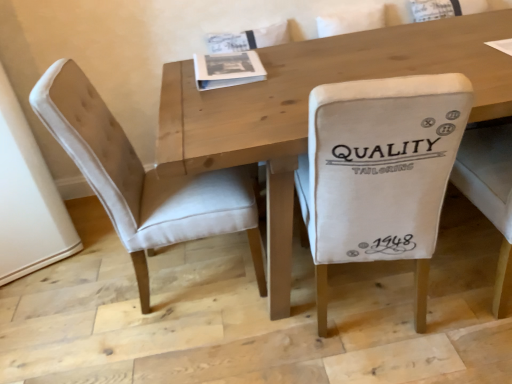
The height and width of the screenshot is (384, 512). Describe the element at coordinates (227, 70) in the screenshot. I see `white paper book at center` at that location.

Find the location of a particular element. The image size is (512, 384). white paper book at center is located at coordinates (227, 70).

From the image's perspective, is beige fabric chair at left, the 2th chair in the right-to-left sequence, over white paper book at center?

No, from the image's perspective, beige fabric chair at left, the 2th chair in the right-to-left sequence, is not above white paper book at center.

In the scene shown: Can you confirm if beige fabric chair at left, the 1th chair in the left-to-right sequence, is smaller than white paper book at center?

No, beige fabric chair at left, the 1th chair in the left-to-right sequence, is not smaller than white paper book at center.

Considering the sizes of objects beige fabric chair at left, the 2th chair in the right-to-left sequence, and white paper book at center in the image provided, who is thinner, beige fabric chair at left, the 2th chair in the right-to-left sequence, or white paper book at center?

white paper book at center is thinner.

Considering the positions of objects beige fabric chair at left, the 1th chair in the left-to-right sequence, and white paper book at center in the image provided, who is more to the left, beige fabric chair at left, the 1th chair in the left-to-right sequence, or white paper book at center?

Positioned to the left is beige fabric chair at left, the 1th chair in the left-to-right sequence.

Which is less distant, (280,201) or (259,71)?

Point (280,201) is closer to the camera than point (259,71).

Does wooden table at center touch white paper book at center?

No, wooden table at center is not beside white paper book at center.

From the image's perspective, is wooden table at center located above or below white paper book at center?

Based on their image positions, wooden table at center is located beneath white paper book at center.

Considering the sizes of wooden table at center and white paper book at center in the image, is wooden table at center taller or shorter than white paper book at center?

In the image, wooden table at center appears to be taller than white paper book at center.

Which object is further away from the camera taking this photo, beige fabric chair at left, the 1th chair in the left-to-right sequence, or white fabric chair at center, the 2th chair when ordered from left to right?

beige fabric chair at left, the 1th chair in the left-to-right sequence, is more distant.

Can you tell me how much beige fabric chair at left, the 2th chair in the right-to-left sequence, and white fabric chair at center, the first chair from the right, differ in facing direction?

The angular difference between beige fabric chair at left, the 2th chair in the right-to-left sequence, and white fabric chair at center, the first chair from the right, is 80.8 degrees.

Identify the location of chair in front of the beige fabric chair at left, the 1th chair in the left-to-right sequence. Image resolution: width=512 pixels, height=384 pixels. click(380, 172).

Based on their sizes in the image, would you say white paper book at center is bigger or smaller than wooden table at center?

Considering their sizes, white paper book at center takes up less space than wooden table at center.

Which is more to the left, white paper book at center or wooden table at center?

white paper book at center is more to the left.

Which is in front, point (246, 60) or point (269, 80)?

The point (269, 80) is closer.

There is a wooden table at center. What are the coordinates of `magazine above it (from a real-world perspective)` in the screenshot? It's located at (227, 70).

From a real-world perspective, is white paper book at center on beige fabric chair at left, the 1th chair in the left-to-right sequence?

Yes, from a real-world perspective, white paper book at center is above beige fabric chair at left, the 1th chair in the left-to-right sequence.

From their relative heights in the image, would you say white paper book at center is taller or shorter than beige fabric chair at left, the 2th chair in the right-to-left sequence?

In the image, white paper book at center appears to be shorter than beige fabric chair at left, the 2th chair in the right-to-left sequence.

Could you tell me if white paper book at center is facing beige fabric chair at left, the 1th chair in the left-to-right sequence?

Yes, white paper book at center is aimed at beige fabric chair at left, the 1th chair in the left-to-right sequence.

Does white paper book at center have a greater width compared to beige fabric chair at left, the 2th chair in the right-to-left sequence?

No.

Does white fabric chair at center, the first chair from the right, have a larger size compared to wooden table at center?

No, white fabric chair at center, the first chair from the right, is not bigger than wooden table at center.

Does white fabric chair at center, the 2th chair when ordered from left to right, lie behind wooden table at center?

No, white fabric chair at center, the 2th chair when ordered from left to right, is in front of wooden table at center.

Does point (413, 240) appear closer or farther from the camera than point (353, 68)?

Clearly, point (413, 240) is closer to the camera than point (353, 68).

Is white fabric chair at center, the 2th chair when ordered from left to right, not near wooden table at center?

No, white fabric chair at center, the 2th chair when ordered from left to right, is not far from wooden table at center.

Find the location of a particular element. magazine above the white fabric chair at center, the 2th chair when ordered from left to right (from a real-world perspective) is located at coordinates (227, 70).

Based on the photo, looking at the image, does white fabric chair at center, the 2th chair when ordered from left to right, seem bigger or smaller compared to white paper book at center?

Considering their sizes, white fabric chair at center, the 2th chair when ordered from left to right, takes up more space than white paper book at center.

Is white fabric chair at center, the 2th chair when ordered from left to right, next to white paper book at center?

No, white fabric chair at center, the 2th chair when ordered from left to right, is not making contact with white paper book at center.

Does white fabric chair at center, the 2th chair when ordered from left to right, turn towards white paper book at center?

No, white fabric chair at center, the 2th chair when ordered from left to right, is not aimed at white paper book at center.

Locate an element on the screen. The image size is (512, 384). chair on the left of white paper book at center is located at coordinates pyautogui.click(x=143, y=178).

The height and width of the screenshot is (384, 512). I want to click on table that appears below the white paper book at center (from a real-world perspective), so click(x=307, y=107).

When comparing their distances from wooden table at center, does white fabric chair at center, the 2th chair when ordered from left to right, or white paper book at center seem further?

white fabric chair at center, the 2th chair when ordered from left to right, is positioned further to the anchor wooden table at center.

From the image, which object appears to be farther from white paper book at center, wooden table at center or white fabric chair at center, the first chair from the right?

The object further to white paper book at center is white fabric chair at center, the first chair from the right.

When comparing their distances from white paper book at center, does beige fabric chair at left, the 1th chair in the left-to-right sequence, or wooden table at center seem further?

Among the two, beige fabric chair at left, the 1th chair in the left-to-right sequence, is located further to white paper book at center.

From the image, which object appears to be farther from white fabric chair at center, the 2th chair when ordered from left to right, wooden table at center or beige fabric chair at left, the 1th chair in the left-to-right sequence?

beige fabric chair at left, the 1th chair in the left-to-right sequence, lies further to white fabric chair at center, the 2th chair when ordered from left to right, than the other object.

Looking at the image, which one is located closer to white paper book at center, white fabric chair at center, the 2th chair when ordered from left to right, or beige fabric chair at left, the 1th chair in the left-to-right sequence?

Based on the image, beige fabric chair at left, the 1th chair in the left-to-right sequence, appears to be nearer to white paper book at center.

Based on their spatial positions, is beige fabric chair at left, the 1th chair in the left-to-right sequence, or white paper book at center further from white fabric chair at center, the 2th chair when ordered from left to right?

Among the two, white paper book at center is located further to white fabric chair at center, the 2th chair when ordered from left to right.

Considering their positions, is wooden table at center positioned closer to beige fabric chair at left, the 1th chair in the left-to-right sequence, than white fabric chair at center, the first chair from the right?

Based on the image, wooden table at center appears to be nearer to beige fabric chair at left, the 1th chair in the left-to-right sequence.

Considering their positions, is white fabric chair at center, the first chair from the right, positioned closer to wooden table at center than beige fabric chair at left, the 2th chair in the right-to-left sequence?

white fabric chair at center, the first chair from the right, lies closer to wooden table at center than the other object.

This screenshot has height=384, width=512. Find the location of `magazine situated between beige fabric chair at left, the 1th chair in the left-to-right sequence, and wooden table at center from left to right`. magazine situated between beige fabric chair at left, the 1th chair in the left-to-right sequence, and wooden table at center from left to right is located at coordinates (227, 70).

The width and height of the screenshot is (512, 384). I want to click on chair between white paper book at center and wooden table at center, so click(x=380, y=172).

What are the coordinates of `magazine between beige fabric chair at left, the 1th chair in the left-to-right sequence, and white fabric chair at center, the first chair from the right, in the horizontal direction` in the screenshot? It's located at (227, 70).

You are a GUI agent. You are given a task and a screenshot of the screen. Output one action in this format:
    pyautogui.click(x=<x>, y=<y>)
    Task: Click on the chair situated between beige fabric chair at left, the 1th chair in the left-to-right sequence, and wooden table at center from left to right
    The width and height of the screenshot is (512, 384).
    Given the screenshot: What is the action you would take?
    pyautogui.click(x=380, y=172)